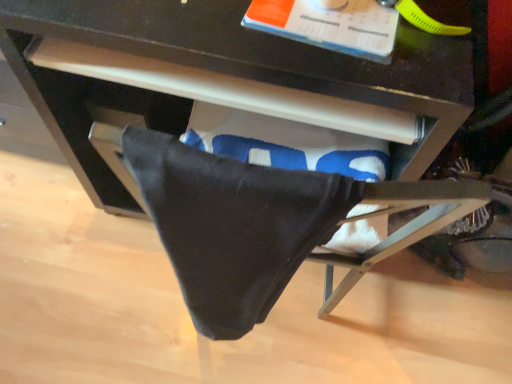
Question: From a real-world perspective, is black cotton towel at lower center positioned above or below matte black drawer at center?

Choices:
 (A) below
 (B) above

Answer: (B)

Question: In terms of size, does black cotton towel at lower center appear bigger or smaller than matte black drawer at center?

Choices:
 (A) small
 (B) big

Answer: (A)

Question: In terms of width, does black cotton towel at lower center look wider or thinner when compared to matte black drawer at center?

Choices:
 (A) wide
 (B) thin

Answer: (B)

Question: Is matte black drawer at center bigger or smaller than black cotton towel at lower center?

Choices:
 (A) big
 (B) small

Answer: (A)

Question: Considering the positions of matte black drawer at center and black cotton towel at lower center in the image, is matte black drawer at center taller or shorter than black cotton towel at lower center?

Choices:
 (A) short
 (B) tall

Answer: (B)

Question: Is point (358, 84) positioned closer to the camera than point (245, 248)?

Choices:
 (A) farther
 (B) closer

Answer: (A)

Question: From a real-world perspective, is matte black drawer at center physically located above or below black cotton towel at lower center?

Choices:
 (A) below
 (B) above

Answer: (A)